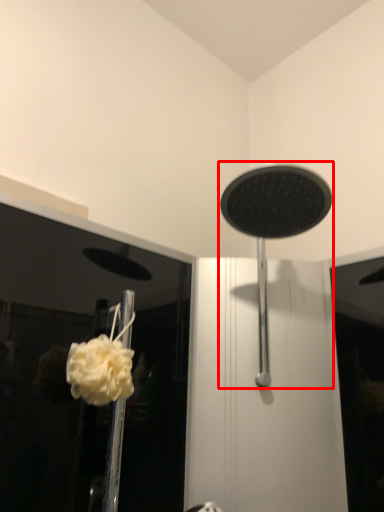
Question: Observing the image, what is the correct spatial positioning of shower (annotated by the red box) in reference to flower?

Choices:
 (A) left
 (B) right

Answer: (B)